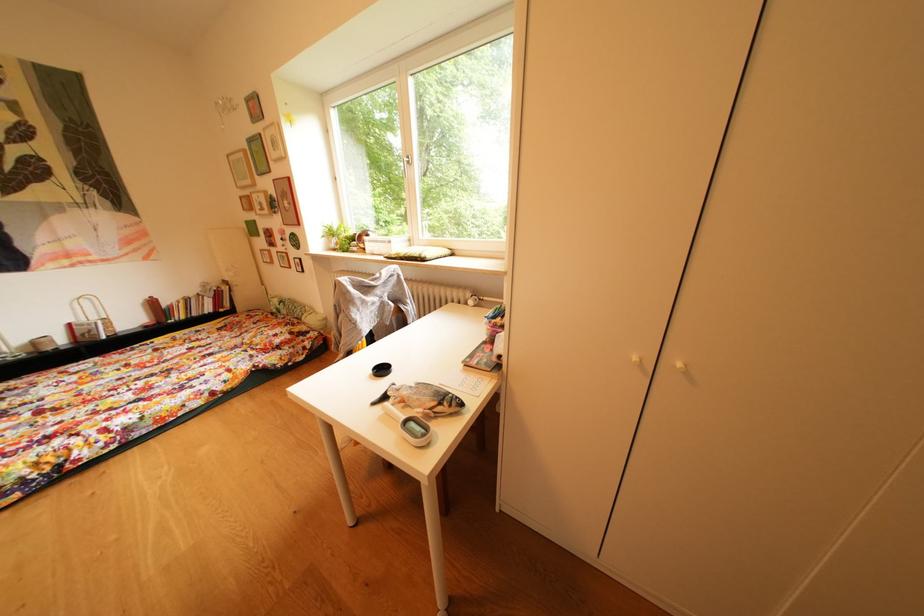
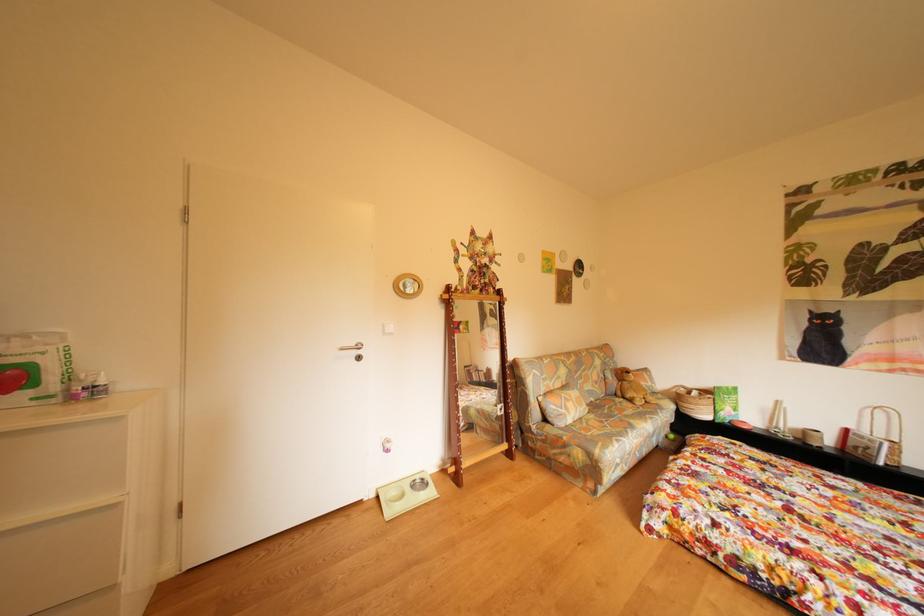
Question: The first image is from the beginning of the video and the second image is from the end. How did the camera likely rotate when shooting the video?

Choices:
 (A) Left
 (B) Right
 (C) Up
 (D) Down

Answer: (A)